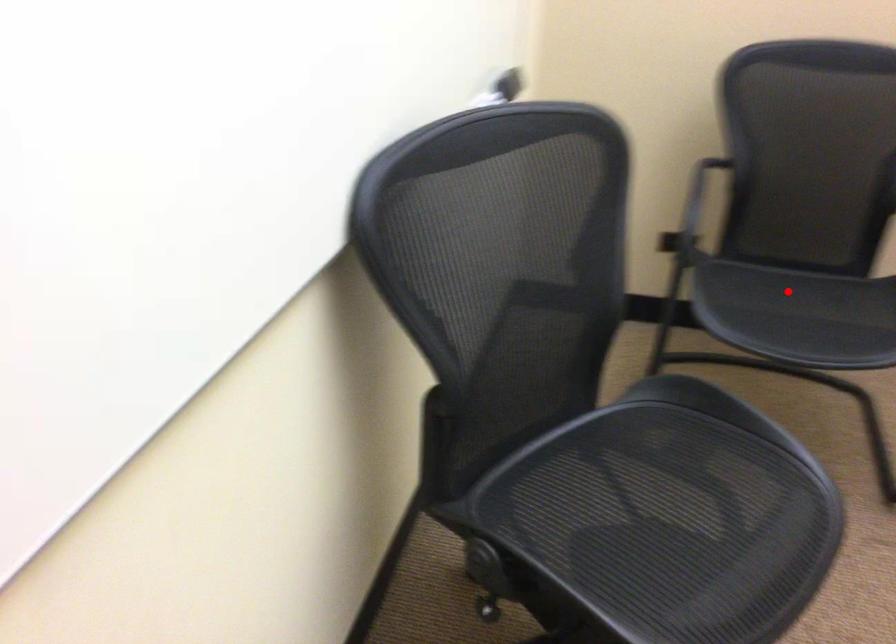
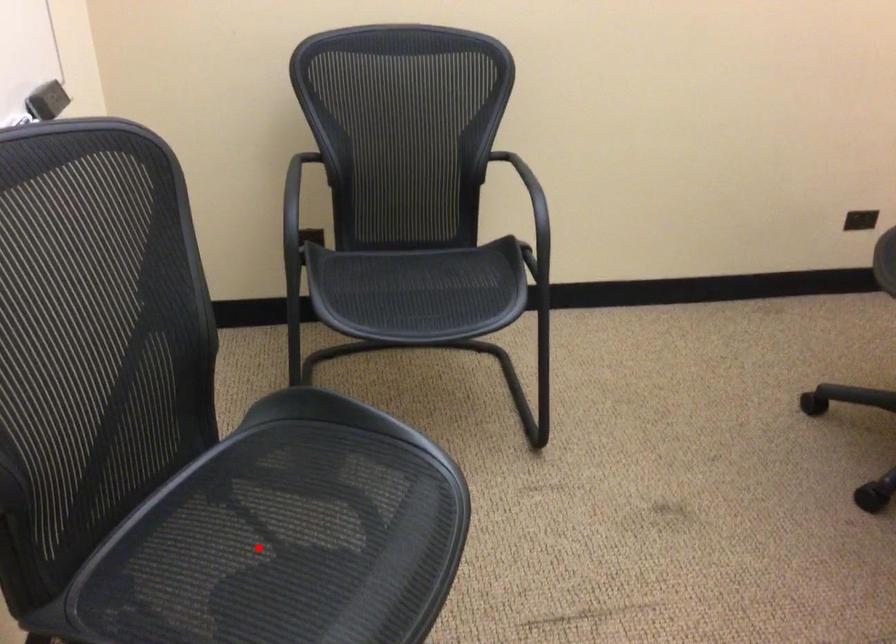
I am providing you with two images of the same scene from different viewpoints. A red point is marked on the first image and another point is marked on the second image. Do the highlighted points in image1 and image2 indicate the same real-world spot?

No